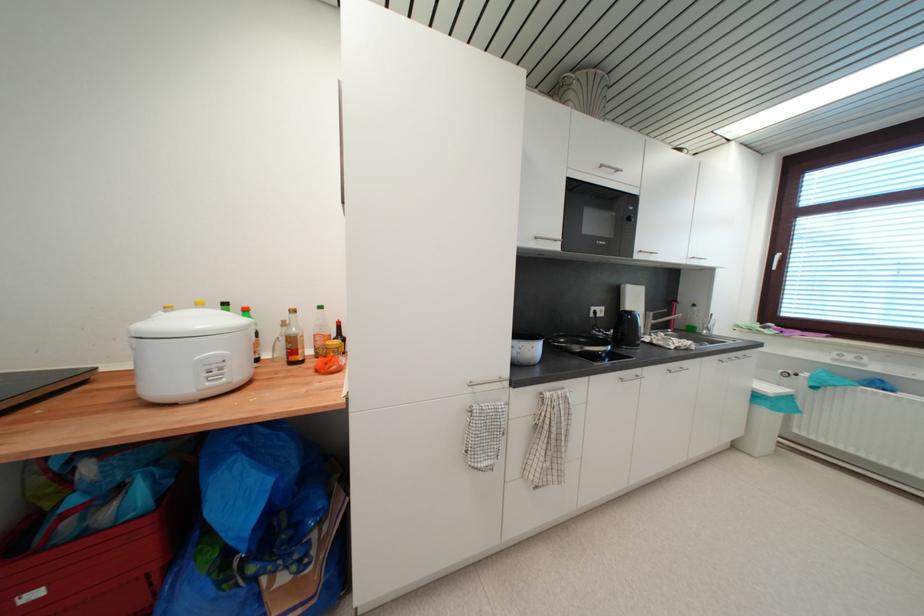
This screenshot has width=924, height=616. What do you see at coordinates (707, 322) in the screenshot?
I see `a faucet handle` at bounding box center [707, 322].